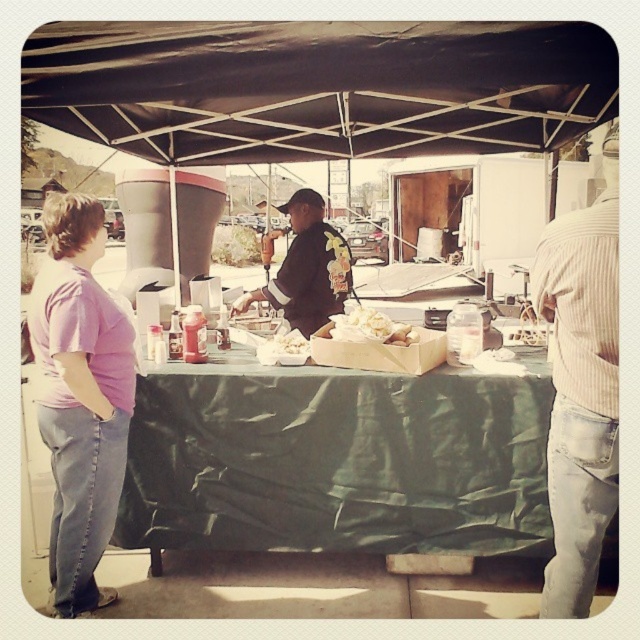
Which is below, black fabric canopy at center or black jersey at center?

black jersey at center is below.

Looking at this image, how much distance is there between black fabric canopy at center and black jersey at center?

The distance of black fabric canopy at center from black jersey at center is 3.85 feet.

Between point (563, 141) and point (323, 209), which one is positioned in front?

Point (323, 209) is in front.

Identify the location of black fabric canopy at center. (317, 86).

Is black fabric canopy at center closer to the viewer compared to white striped sweater at right?

No.

The image size is (640, 640). In order to click on black fabric canopy at center in this screenshot , I will do `click(317, 86)`.

Is point (440, 422) positioned after point (349, 314)?

That is False.

Is green fabric table at center to the right of white paper bag at center from the viewer's perspective?

No, green fabric table at center is not to the right of white paper bag at center.

What do you see at coordinates (337, 461) in the screenshot?
I see `green fabric table at center` at bounding box center [337, 461].

Locate an element on the screen. The height and width of the screenshot is (640, 640). green fabric table at center is located at coordinates point(337,461).